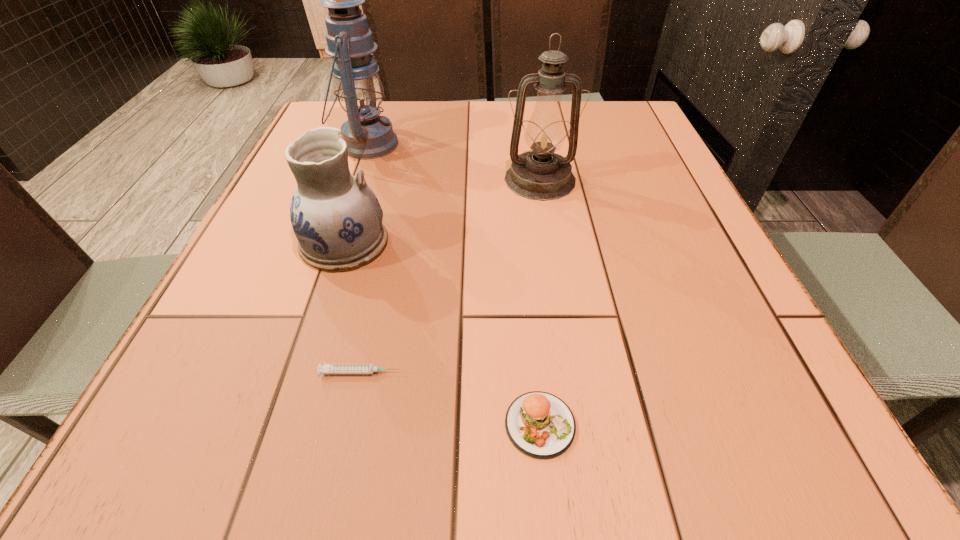
Find the location of a particular element. The height and width of the screenshot is (540, 960). empty space between the lantern and the oil lamp is located at coordinates (453, 162).

Identify the location of unoccupied position between the shortest object and the patty. (450, 399).

Identify the location of unoccupied area between the pottery and the nearest object. This screenshot has height=540, width=960. (442, 334).

Where is `object that stands as the closest to the second shortest object`? object that stands as the closest to the second shortest object is located at coordinates (326, 368).

In order to click on the fourth closest object relative to the syringe in this screenshot , I will do click(360, 92).

Locate an element on the screen. vacant region that satisfies the following two spatial constraints: 1. at the needle end of the syringe; 2. on the back side of the second shortest object is located at coordinates (349, 424).

The height and width of the screenshot is (540, 960). I want to click on vacant space that satisfies the following two spatial constraints: 1. on the front-facing side of the pottery; 2. on the right side of the lantern, so click(332, 243).

Image resolution: width=960 pixels, height=540 pixels. Identify the location of blank space that satisfies the following two spatial constraints: 1. on the front-facing side of the oil lamp; 2. on the right side of the lantern. (354, 180).

What are the coordinates of `vacant space that satisfies the following two spatial constraints: 1. at the needle end of the second shortest object; 2. on the left side of the fourth farthest object` in the screenshot? It's located at (349, 424).

You are a GUI agent. You are given a task and a screenshot of the screen. Output one action in this format:
    pyautogui.click(x=<x>, y=<y>)
    Task: Click on the vacant region that satisfies the following two spatial constraints: 1. on the front-facing side of the oil lamp; 2. on the left side of the lantern
    
    Given the screenshot: What is the action you would take?
    pyautogui.click(x=354, y=180)